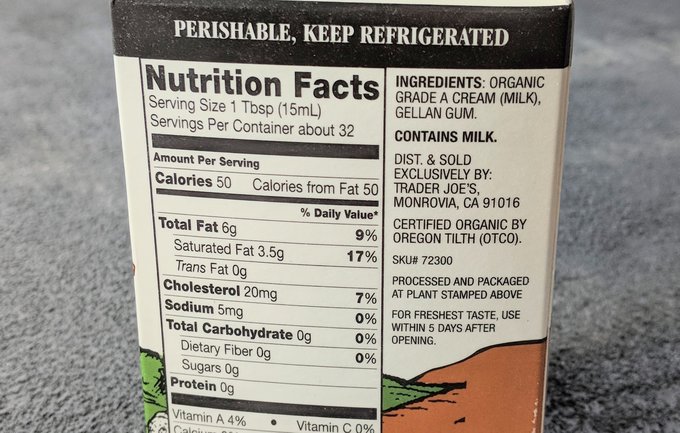
This screenshot has width=680, height=433. I want to click on fluffy blanket, so click(x=50, y=253), click(x=615, y=286).